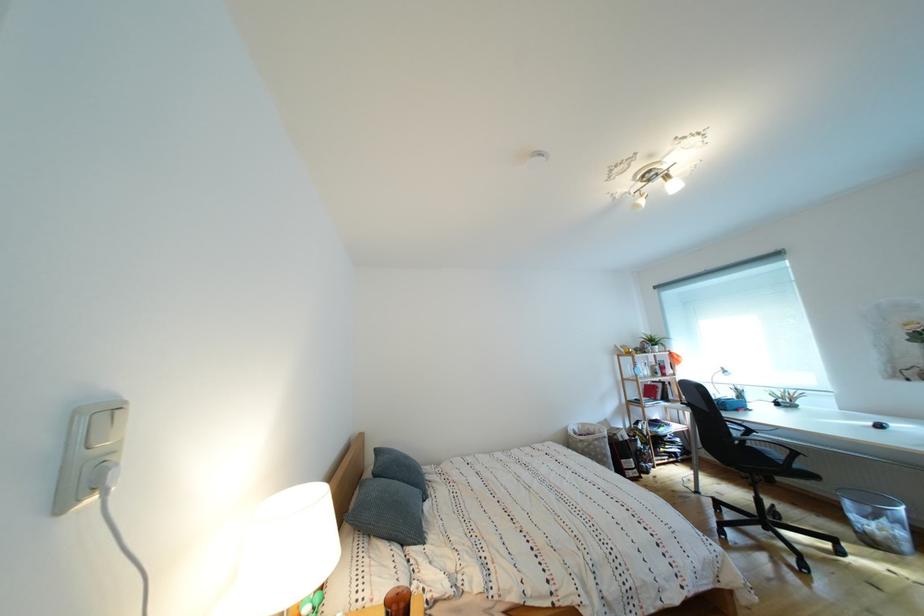
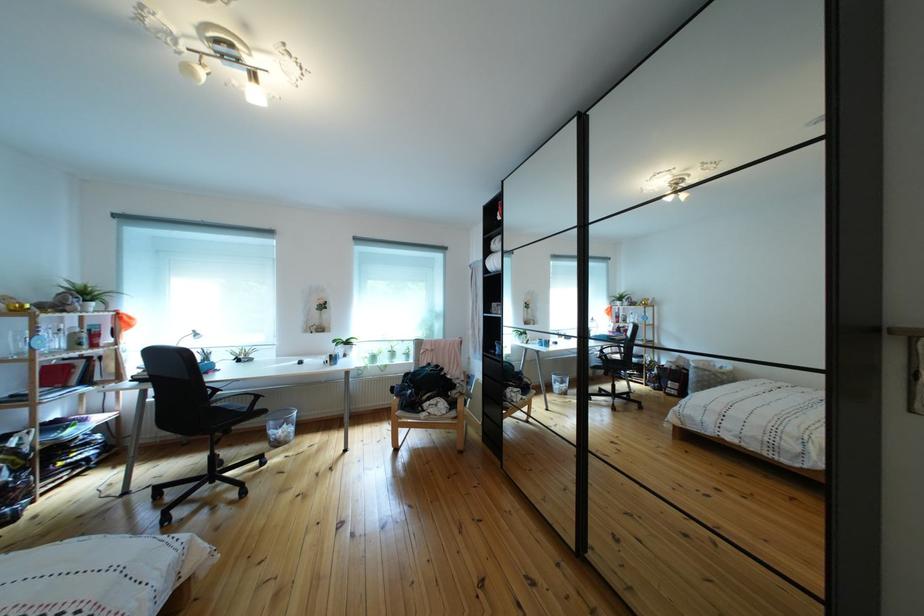
Question: The images are taken continuously from a first-person perspective. In which direction is your viewpoint rotating?

Choices:
 (A) Left
 (B) Right
 (C) Up
 (D) Down

Answer: (B)